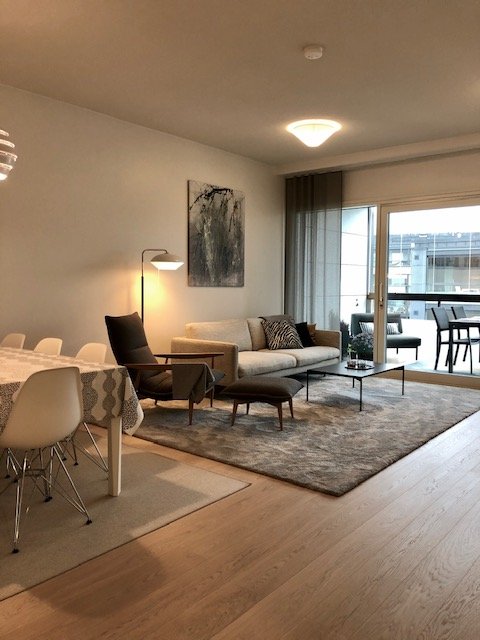
Find the location of a particular element. The height and width of the screenshot is (640, 480). long black singular seat is located at coordinates (159, 377), (253, 386).